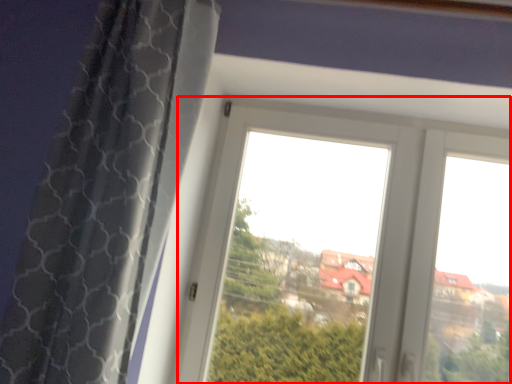
Question: Considering the relative positions of window (annotated by the red box) and curtain in the image provided, where is window (annotated by the red box) located with respect to the staircase?

Choices:
 (A) right
 (B) left

Answer: (A)